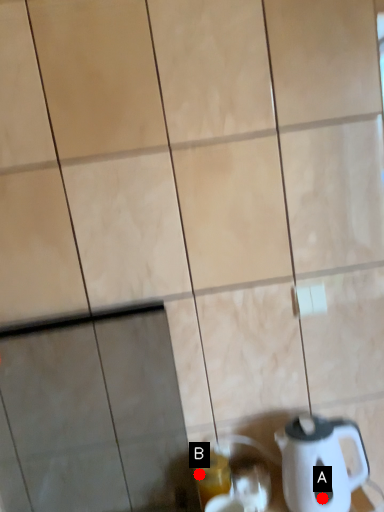
Question: Two points are circled on the image, labeled by A and B beside each circle. Which point is closer to the camera?

Choices:
 (A) A is closer
 (B) B is closer

Answer: (A)